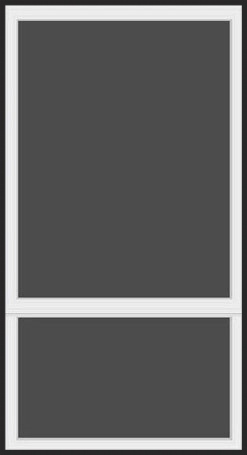
Find the location of `white frame`. white frame is located at coordinates (9, 380), (13, 93).